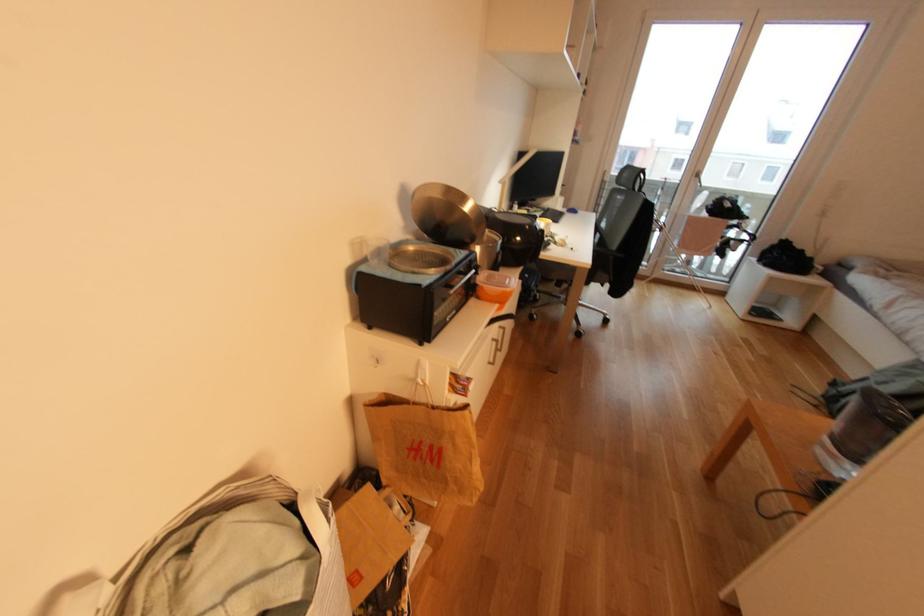
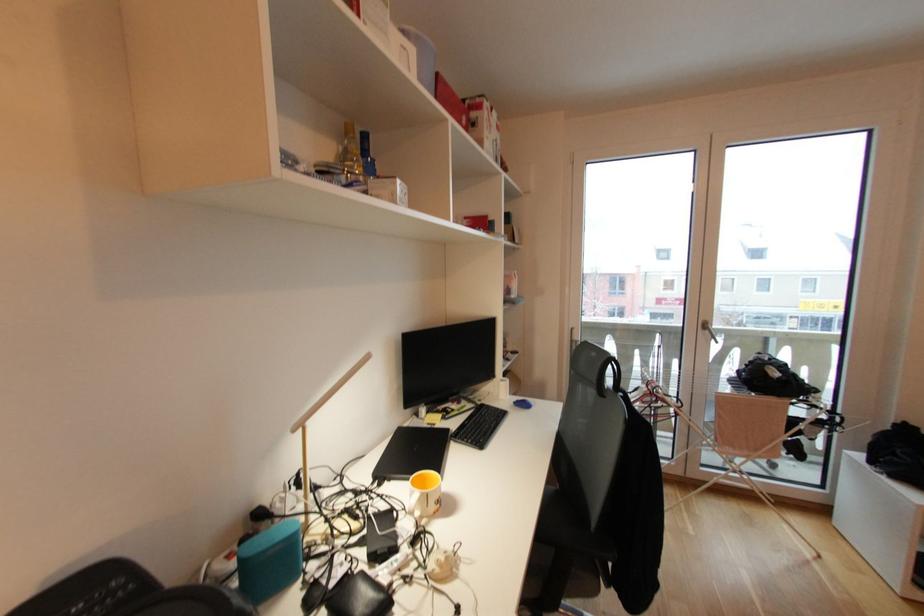
In a continuous first-person perspective shot, in which direction is the camera moving?

The cameraman moved toward right, forward.